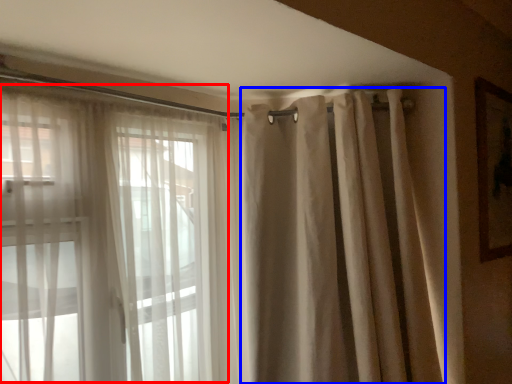
Question: Which object is closer to the camera taking this photo, bay window (highlighted by a red box) or shower curtain (highlighted by a blue box)?

Choices:
 (A) bay window
 (B) shower curtain

Answer: (A)